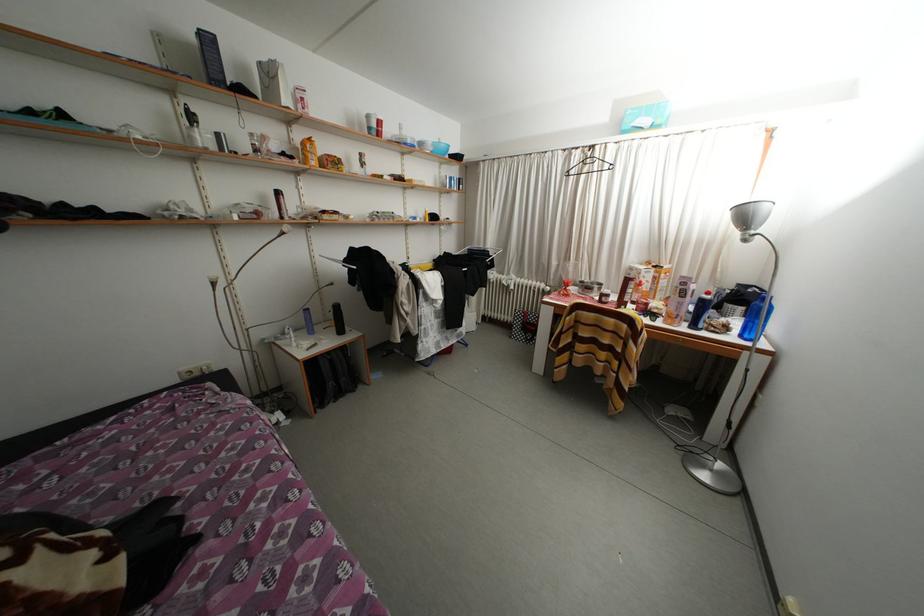
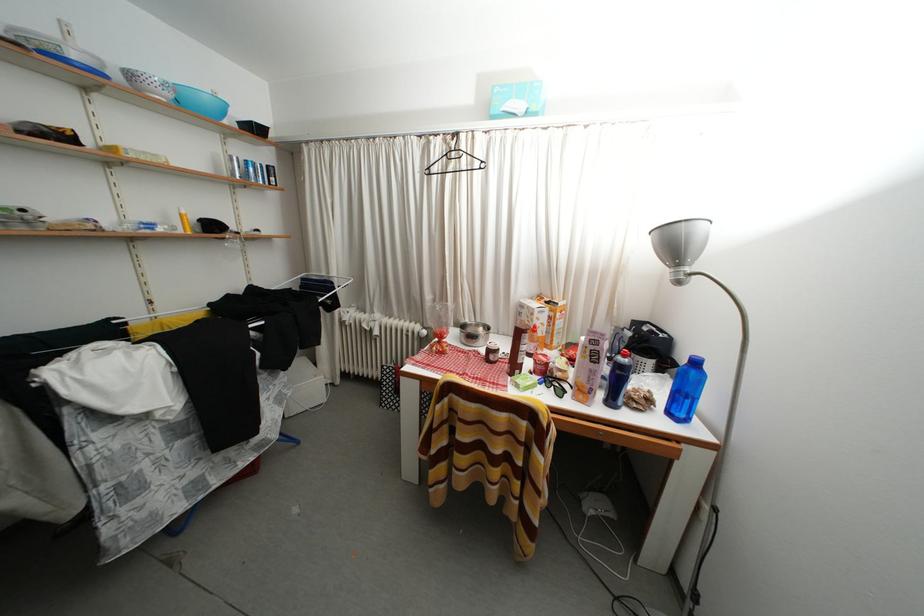
In the second image, find the point that corresponds to pixel 638 274 in the first image.

(529, 310)